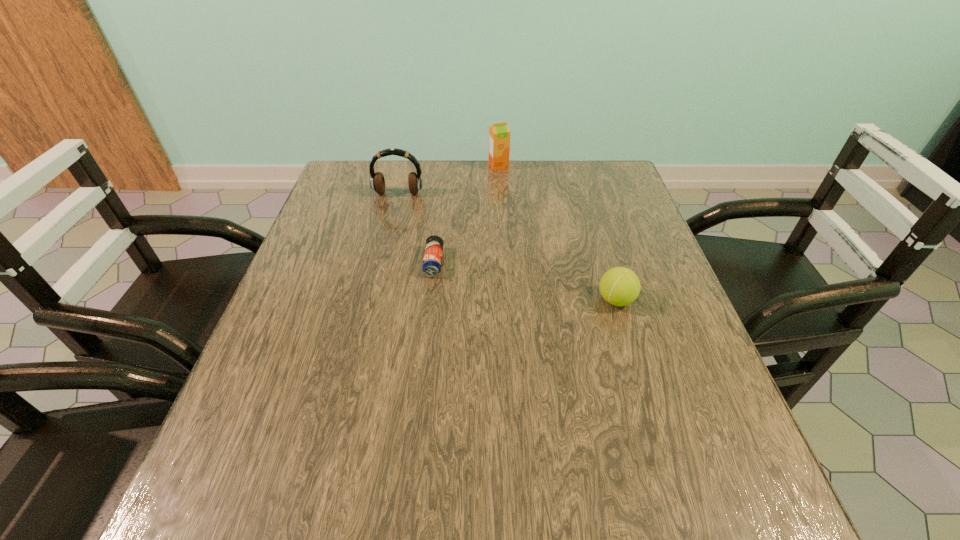
Find the location of a particular element. vacant area that lies between the second farthest object and the rightmost object is located at coordinates (507, 247).

The height and width of the screenshot is (540, 960). Find the location of `vacant point located between the second nearest object and the third nearest object`. vacant point located between the second nearest object and the third nearest object is located at coordinates pyautogui.click(x=416, y=228).

Identify the location of object that ranks as the second closest to the third object from right to left. The height and width of the screenshot is (540, 960). (619, 286).

At what (x,y) coordinates should I click in order to perform the action: click on the closest object to the headset. Please return your answer as a coordinate pair (x, y). This screenshot has width=960, height=540. Looking at the image, I should click on (499, 134).

Where is `vacant space that satisfies the following two spatial constraints: 1. on the ear cup of the leftmost object; 2. on the right side of the beer can`? The image size is (960, 540). vacant space that satisfies the following two spatial constraints: 1. on the ear cup of the leftmost object; 2. on the right side of the beer can is located at coordinates (382, 262).

Locate an element on the screen. The image size is (960, 540). free space in the image that satisfies the following two spatial constraints: 1. on the ear cup of the headset; 2. on the right side of the rightmost object is located at coordinates (373, 300).

Locate an element on the screen. The height and width of the screenshot is (540, 960). free location that satisfies the following two spatial constraints: 1. on the ear cup of the nearest object; 2. on the left side of the third nearest object is located at coordinates (373, 300).

I want to click on free space that satisfies the following two spatial constraints: 1. on the ear cup of the second shortest object; 2. on the left side of the headset, so click(373, 300).

You are a GUI agent. You are given a task and a screenshot of the screen. Output one action in this format:
    pyautogui.click(x=<x>, y=<y>)
    Task: Click on the vacant position in the image that satisfies the following two spatial constraints: 1. on the ear cup of the headset; 2. on the left side of the beer can
    The width and height of the screenshot is (960, 540).
    Given the screenshot: What is the action you would take?
    (x=382, y=262)

I want to click on vacant region that satisfies the following two spatial constraints: 1. on the ear cup of the headset; 2. on the left side of the second object from left to right, so click(382, 262).